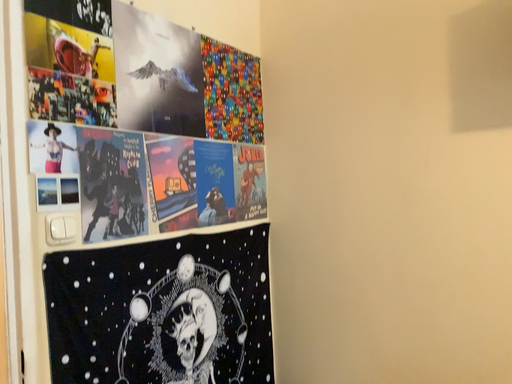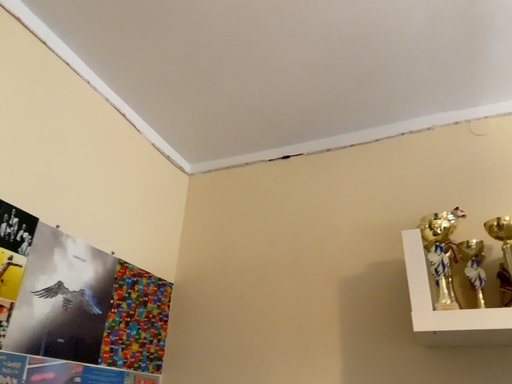
Question: How did the camera likely rotate when shooting the video?

Choices:
 (A) rotated left
 (B) rotated right

Answer: (B)